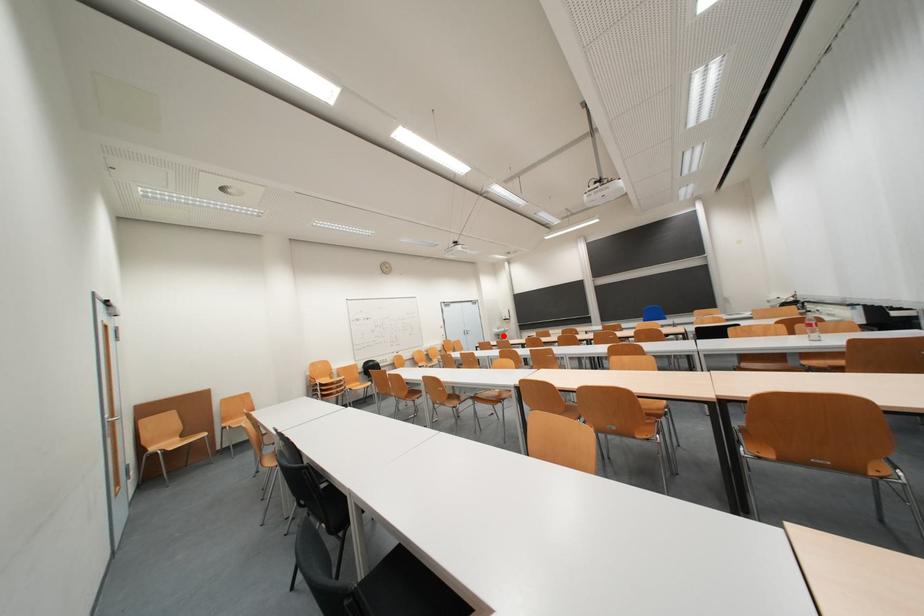
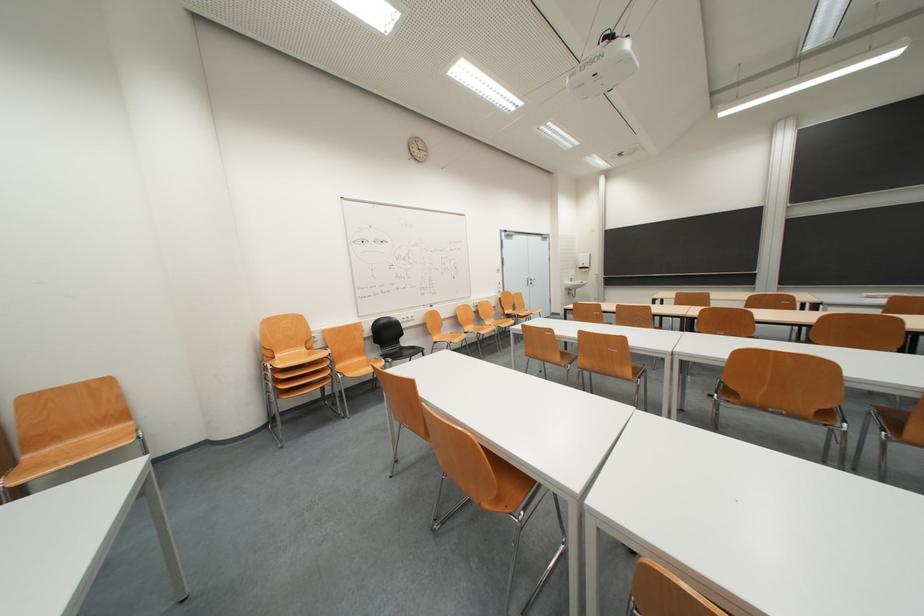
Question: I am providing you with two images of the same scene from different viewpoints. In image1, a red point is highlighted. Considering the same 3D point in image2, which of the following is correct?

Choices:
 (A) It is closer
 (B) It is farther

Answer: (A)